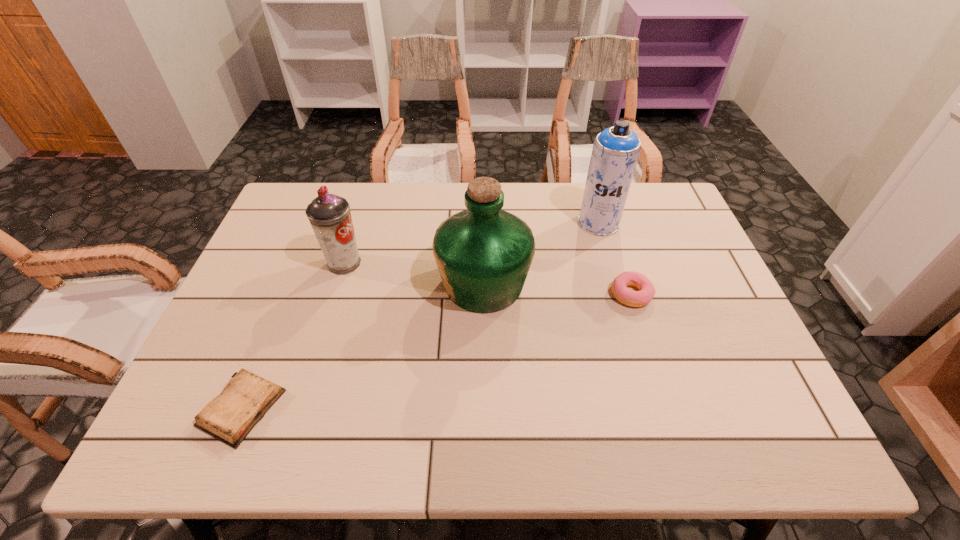
At what (x,y) coordinates should I click in order to perform the action: click on vacant space at the left edge. Please return your answer as a coordinate pair (x, y). This screenshot has width=960, height=540. Looking at the image, I should click on (302, 242).

You are a GUI agent. You are given a task and a screenshot of the screen. Output one action in this format:
    pyautogui.click(x=<x>, y=<y>)
    Task: Click on the vacant region at the right edge of the desktop
    The image size is (960, 540).
    Given the screenshot: What is the action you would take?
    pyautogui.click(x=709, y=343)

In the image, there is a desktop. Where is `blank space at the far left corner`? The width and height of the screenshot is (960, 540). blank space at the far left corner is located at coordinates (319, 185).

Identify the location of free region at the far right corner of the desktop. [668, 222].

Identify the location of vacant point located between the fourth tallest object and the liquor. The width and height of the screenshot is (960, 540). (558, 289).

Find the location of a particular element. This screenshot has width=960, height=540. unoccupied area between the left aerosol can and the liquor is located at coordinates (414, 274).

This screenshot has width=960, height=540. I want to click on vacant space in between the farthest object and the fourth tallest object, so click(x=615, y=259).

Where is `free space between the second shortest object and the liquor`? This screenshot has height=540, width=960. free space between the second shortest object and the liquor is located at coordinates (558, 289).

Where is `vacant space that is in between the second shortest object and the third object from right to left`? vacant space that is in between the second shortest object and the third object from right to left is located at coordinates (558, 289).

I want to click on free area in between the liquor and the diary, so click(363, 346).